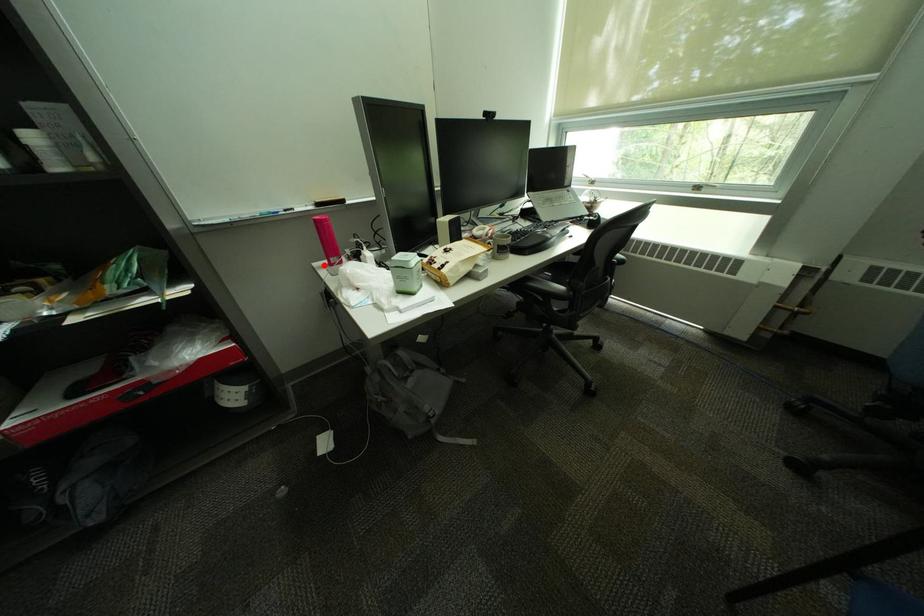
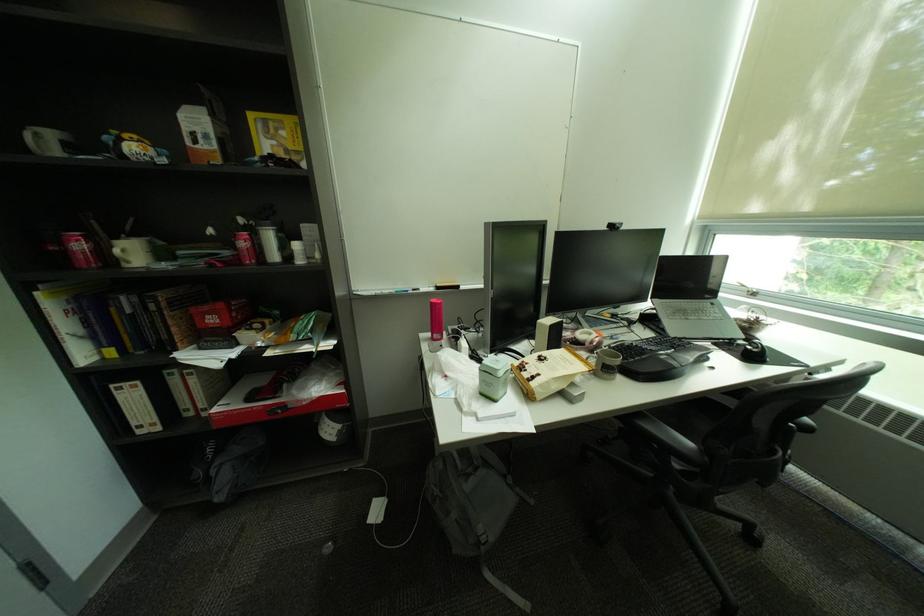
In the second image, find the point that corresponds to the highlighted location in the first image.

(431, 334)